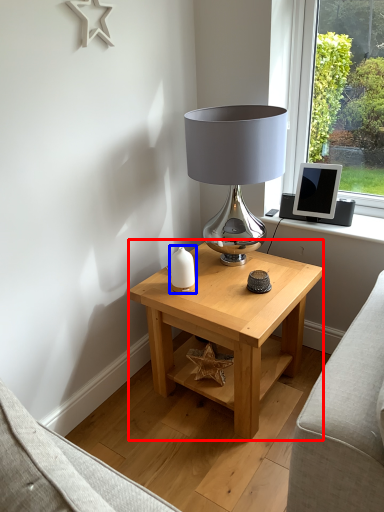
Question: Which object is further to the camera taking this photo, table (highlighted by a red box) or candle holder (highlighted by a blue box)?

Choices:
 (A) table
 (B) candle holder

Answer: (B)